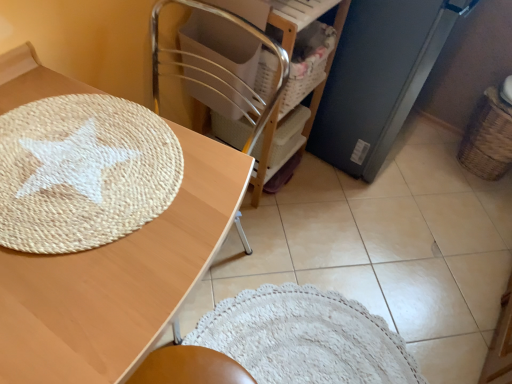
Question: Is point (471, 145) positioned closer to the camera than point (390, 21)?

Choices:
 (A) farther
 (B) closer

Answer: (A)

Question: From the image's perspective, is woven brown basket at right above or below matte black refrigerator at right?

Choices:
 (A) below
 (B) above

Answer: (A)

Question: Which is nearer to the woven brown basket at right?

Choices:
 (A) matte black refrigerator at right
 (B) natural wood table at upper left
 (C) wooden chair at center

Answer: (A)

Question: Estimate the real-world distances between objects in this image. Which object is closer to the matte black refrigerator at right?

Choices:
 (A) woven brown basket at right
 (B) natural wood table at upper left
 (C) wooden chair at center

Answer: (C)